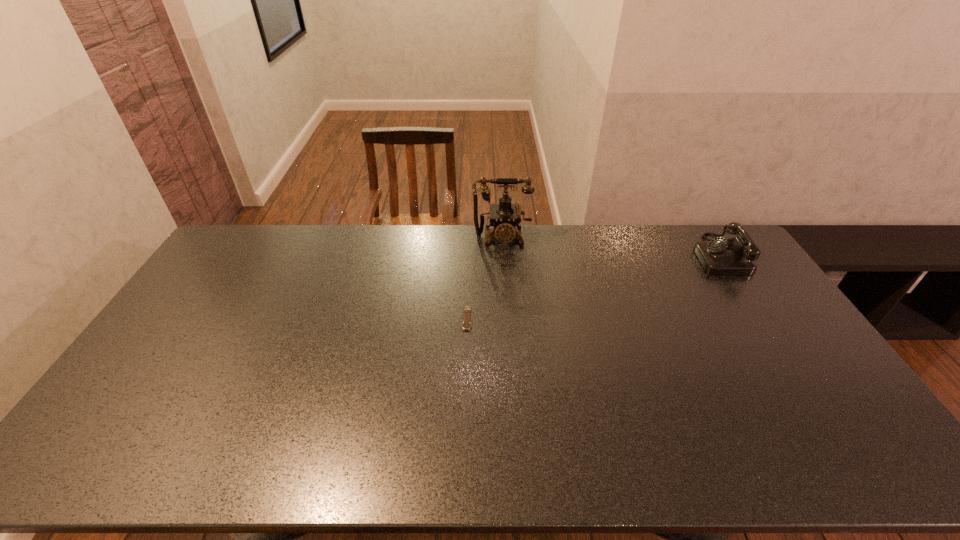
At what (x,y) coordinates should I click in order to perform the action: click on vacant region located 0.070m on the back of the nearest object. Please return your answer as a coordinate pair (x, y). This screenshot has height=540, width=960. Looking at the image, I should click on click(x=468, y=292).

Find the location of a particular element. This screenshot has height=540, width=960. object located at the right edge is located at coordinates (735, 256).

Find the location of a particular element. The image size is (960, 540). object at the far right corner is located at coordinates (735, 256).

In the image, there is a desktop. Identify the location of free space at the far edge. (413, 241).

In the image, there is a desktop. What are the coordinates of `blank space at the near edge` in the screenshot? It's located at (660, 453).

This screenshot has width=960, height=540. What are the coordinates of `vacant region at the right edge of the desktop` in the screenshot? It's located at (758, 338).

You are a GUI agent. You are given a task and a screenshot of the screen. Output one action in this format:
    pyautogui.click(x=<x>, y=<y>)
    Task: Click on the vacant area at the far left corner
    
    Given the screenshot: What is the action you would take?
    pyautogui.click(x=224, y=262)

I want to click on vacant space at the near left corner of the desktop, so click(x=128, y=461).

Locate an element on the screen. vacant area that lies between the second tallest object and the tallest object is located at coordinates (x=610, y=247).

Locate an element on the screen. This screenshot has width=960, height=540. free space between the tallest object and the second shortest object is located at coordinates pyautogui.click(x=610, y=247).